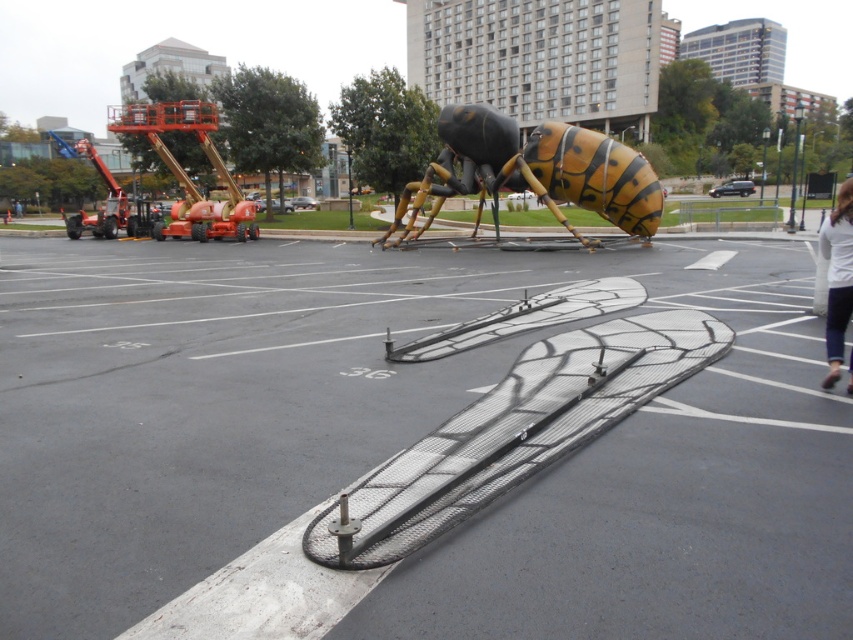
Looking at this image, you are standing at the point labeled as point (407, 440) in the image. Looking around, you see the large wasp sculpture and the orange construction vehicles. Which object is closer to your current position?

The point (407, 440) is on the metallic gray parking lot at center, so the large wasp sculpture dominating the foreground is closer to your position than the orange construction vehicles in the background.